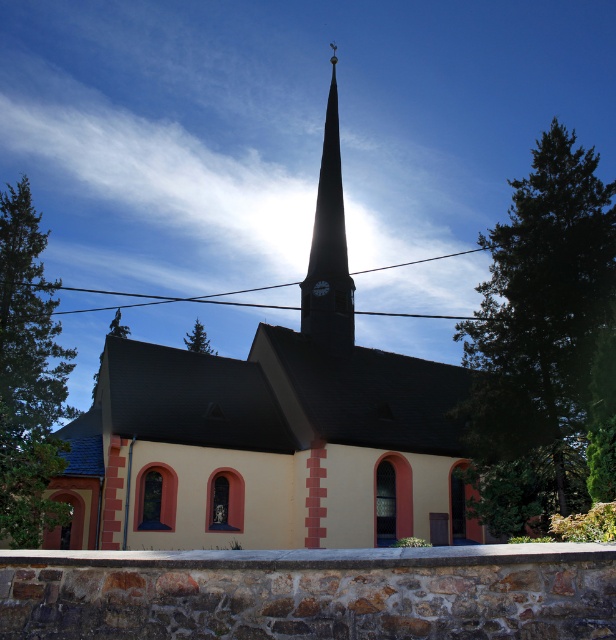
From the picture: You are standing in a park and want to take a photo of the yellow matte church at center. If you have a camera with a standard lens that has a focal length of 50mm, what is the minimum distance you need to move closer to fill the frame with the church?

The yellow matte church at center is 16.17 meters away. To fill the frame with a 50mm lens, you need to be approximately 16.17 meters away. Since you are already at that distance, you don not need to move closer.

You are standing in front of the church and want to place a 3.5 meter long ladder between the smooth gray spire at center and the black glass clock at upper center. Will the ladder fit between them?

The smooth gray spire at center is 3.66 meters from the black glass clock at upper center. Since the ladder is 3.5 meters long, it will fit between them as the distance is slightly longer than the ladder.

You are standing in front of the yellow matte church at center and want to look up to see the smooth gray spire at center. Since the spire is above the church, will you need to tilt your head upwards to see it?

The yellow matte church at center is located below the smooth gray spire at center, so yes, you will need to tilt your head upwards to see the spire since it is positioned above the church.